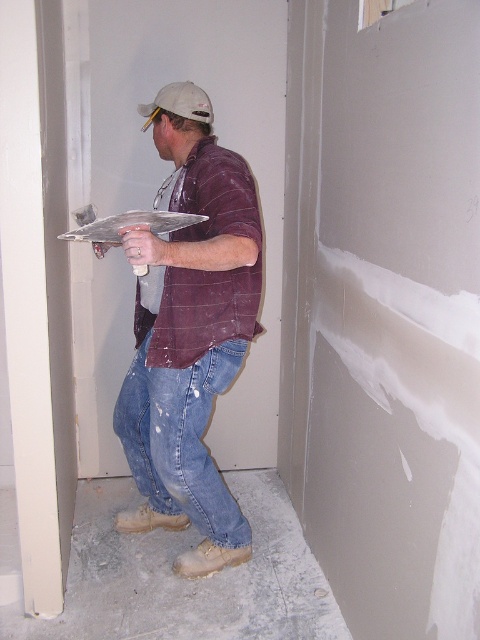
Question: Which object is farther from the camera taking this photo?

Choices:
 (A) white smooth pillar at left
 (B) white matte baseball hat at upper center

Answer: (B)

Question: Which point is closer to the camera?

Choices:
 (A) white smooth pillar at left
 (B) white matte baseball hat at upper center
 (C) matte brown shirt at center
 (D) denim jeans at center

Answer: (A)

Question: Can you confirm if matte brown shirt at center is positioned to the right of denim jeans at center?

Choices:
 (A) yes
 (B) no

Answer: (A)

Question: Which object is closer to the camera taking this photo?

Choices:
 (A) matte brown shirt at center
 (B) white matte baseball hat at upper center

Answer: (A)

Question: Is denim jeans at center below white matte baseball hat at upper center?

Choices:
 (A) no
 (B) yes

Answer: (B)

Question: Can you confirm if matte brown shirt at center is positioned above white matte baseball hat at upper center?

Choices:
 (A) yes
 (B) no

Answer: (B)